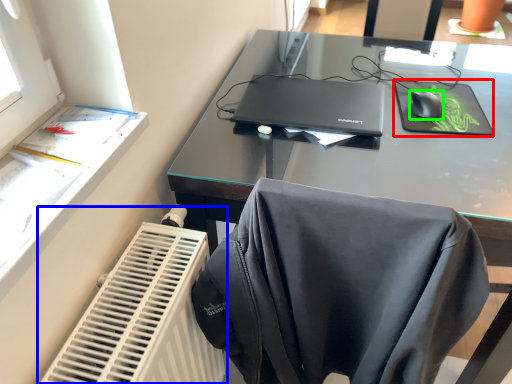
Question: Which is nearer to the mousepad (highlighted by a red box)? radiator (highlighted by a blue box) or mouse (highlighted by a green box).

Choices:
 (A) radiator
 (B) mouse

Answer: (B)